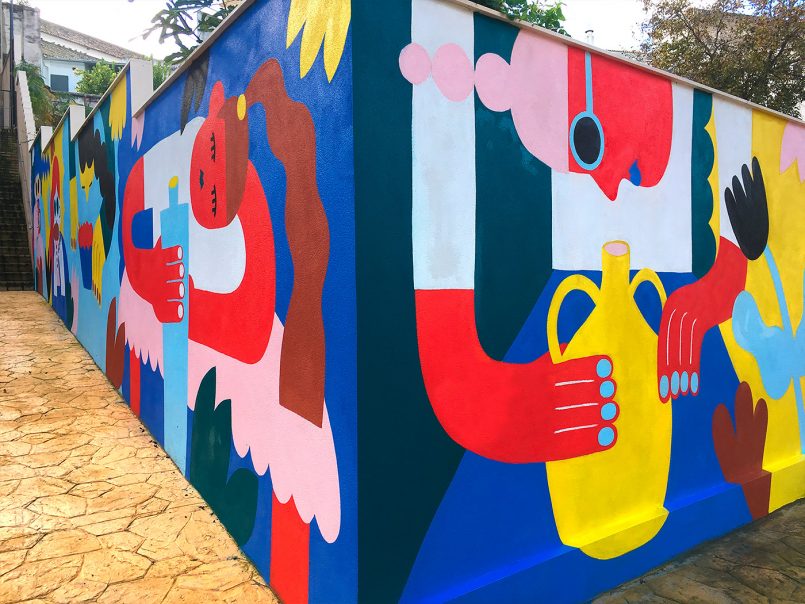
Where is `painted walls`? The image size is (805, 604). painted walls is located at coordinates (674, 297), (101, 243).